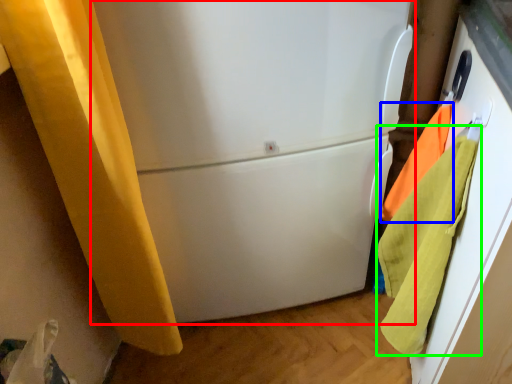
Question: Based on their relative distances, which object is nearer to refrigerator (highlighted by a red box)? Choose from beach towel (highlighted by a blue box) and beach towel (highlighted by a green box).

Choices:
 (A) beach towel
 (B) beach towel

Answer: (B)